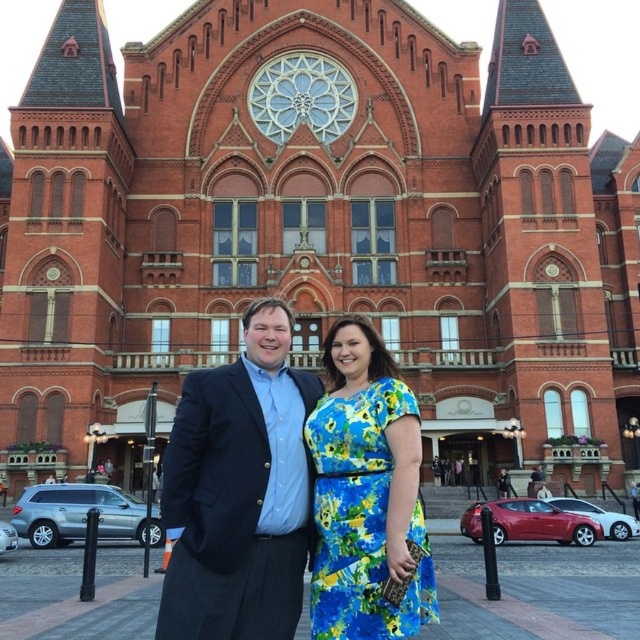
You are a photographer setting up for a group photo. You need to position two subjects so they can both be in focus without overlapping. The subjects are wearing a matte black suit at center and a floral print fabric dress at center. Given their current distance apart, will they fit within the camera frame that has a maximum subject distance of 3 meters between them?

The matte black suit at center and floral print fabric dress at center are 3.63 meters apart, which exceeds the camera frame maximum subject distance of 3 meters. Therefore, they will not fit within the frame without overlapping or adjusting their positions.

You are standing in front of the grand red brick building. There is a point at coordinates (240,492). What is located at that point?

The point at coordinates (240,492) corresponds to the matte black suit at center.